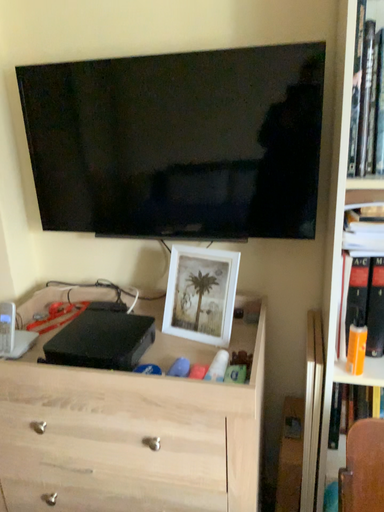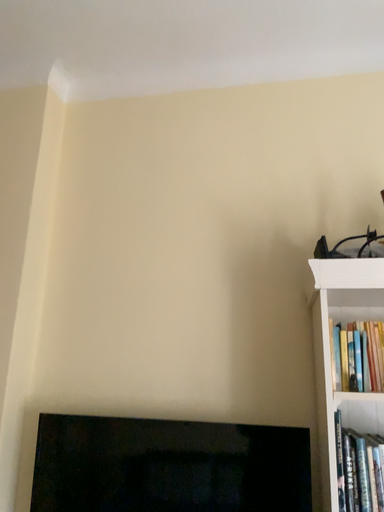
Question: How did the camera likely rotate when shooting the video?

Choices:
 (A) rotated downward
 (B) rotated upward

Answer: (B)